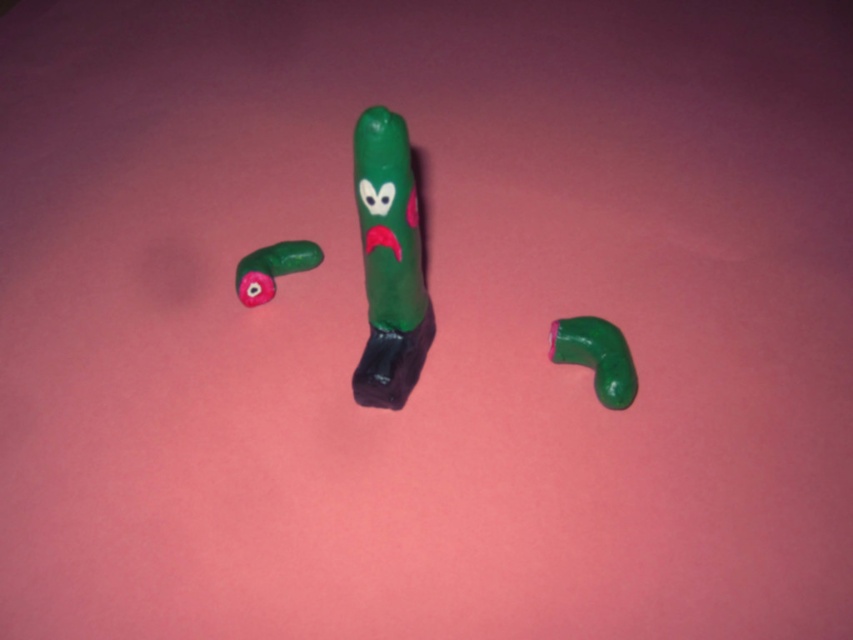
Can you confirm if green matte toy at center is positioned to the left of rubber green cucumber at left?

Incorrect, green matte toy at center is not on the left side of rubber green cucumber at left.

The width and height of the screenshot is (853, 640). In order to click on green matte toy at center in this screenshot , I will do `click(596, 356)`.

Looking at this image, between green matte plastic toy at center and rubber green cucumber at left, which one appears on the left side from the viewer's perspective?

rubber green cucumber at left

Is green matte plastic toy at center smaller than rubber green cucumber at left?

Actually, green matte plastic toy at center might be larger than rubber green cucumber at left.

Identify the location of green matte plastic toy at center. This screenshot has height=640, width=853. (389, 262).

Who is positioned more to the left, green matte plastic toy at center or green matte toy at center?

green matte plastic toy at center is more to the left.

Which is more to the right, green matte plastic toy at center or green matte toy at center?

Positioned to the right is green matte toy at center.

Between point (387, 202) and point (561, 358), which one is positioned behind?

The point (561, 358) is more distant.

What are the coordinates of `green matte plastic toy at center` in the screenshot? It's located at (389, 262).